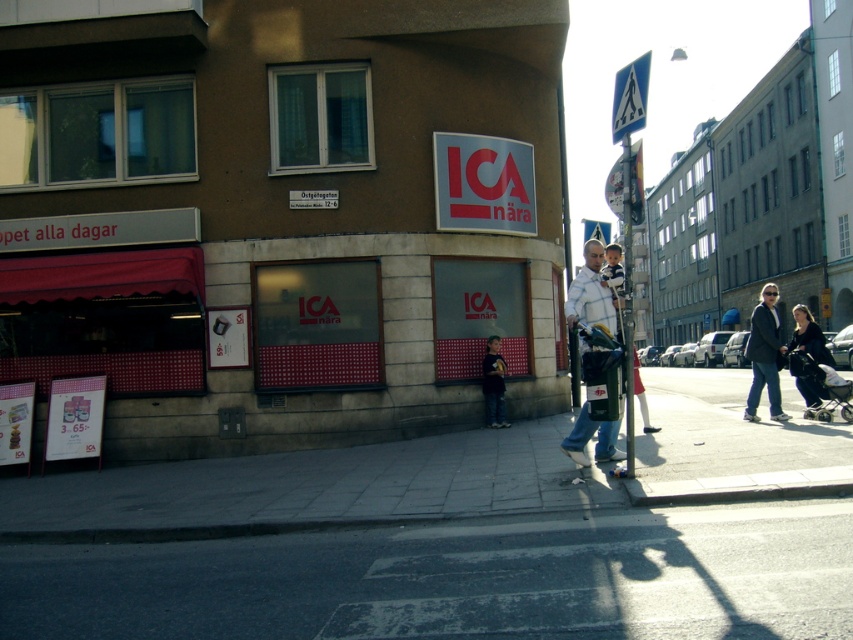
Is dark gray suit at right closer to the viewer compared to gray fabric baby carriage at lower right?

No, dark gray suit at right is further to the viewer.

Between point (776, 394) and point (811, 410), which one is positioned in front?

Point (811, 410) is more forward.

You are a GUI agent. You are given a task and a screenshot of the screen. Output one action in this format:
    pyautogui.click(x=<x>, y=<y>)
    Task: Click on the dark gray suit at right
    
    Given the screenshot: What is the action you would take?
    pyautogui.click(x=764, y=355)

Does asphalt at lower center appear on the right side of metallic pole at center?

In fact, asphalt at lower center is to the left of metallic pole at center.

Between point (809, 573) and point (624, 157), which one is positioned behind?

Positioned behind is point (624, 157).

The width and height of the screenshot is (853, 640). Identify the location of asphalt at lower center. (457, 579).

Does gray fabric baby carriage at lower right have a larger size compared to denim pants at center?

Yes, gray fabric baby carriage at lower right is bigger than denim pants at center.

Which is below, gray fabric baby carriage at lower right or denim pants at center?

gray fabric baby carriage at lower right is below.

Is point (819, 406) positioned after point (492, 380)?

No.

The image size is (853, 640). Identify the location of gray fabric baby carriage at lower right. (821, 387).